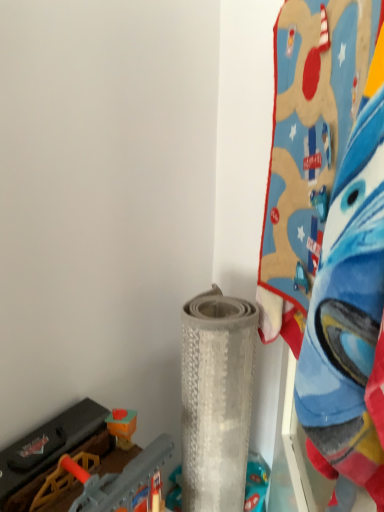
Question: Is the position of gray textured mat at center, the second toy viewed from the left, more distant than that of blue plush blanket at upper right, the 3th toy positioned from the left?

Choices:
 (A) no
 (B) yes

Answer: (B)

Question: Is gray textured mat at center, the second toy viewed from the left, positioned with its back to blue plush blanket at upper right, the 3th toy positioned from the left?

Choices:
 (A) yes
 (B) no

Answer: (B)

Question: Is gray textured mat at center, acting as the second toy starting from the right, positioned in front of blue plush blanket at upper right, the 3th toy positioned from the left?

Choices:
 (A) no
 (B) yes

Answer: (A)

Question: Is gray textured mat at center, acting as the second toy starting from the right, positioned far away from blue plush blanket at upper right, the 3th toy positioned from the left?

Choices:
 (A) no
 (B) yes

Answer: (A)

Question: From the image's perspective, is gray textured mat at center, the second toy viewed from the left, below blue plush blanket at upper right, the 3th toy positioned from the left?

Choices:
 (A) no
 (B) yes

Answer: (B)

Question: Considering the positions of blue plush blanket at upper right, the 3th toy positioned from the left, and gray textured mat at center, acting as the second toy starting from the right, in the image, is blue plush blanket at upper right, the 3th toy positioned from the left, taller or shorter than gray textured mat at center, acting as the second toy starting from the right,?

Choices:
 (A) short
 (B) tall

Answer: (A)

Question: In terms of size, does blue plush blanket at upper right, the 3th toy positioned from the left, appear bigger or smaller than gray textured mat at center, acting as the second toy starting from the right?

Choices:
 (A) big
 (B) small

Answer: (A)

Question: Is blue plush blanket at upper right, the 3th toy positioned from the left, spatially inside gray textured mat at center, the second toy viewed from the left, or outside of it?

Choices:
 (A) inside
 (B) outside

Answer: (B)

Question: Is blue plush blanket at upper right, the 3th toy positioned from the left, wider or thinner than gray textured mat at center, acting as the second toy starting from the right?

Choices:
 (A) wide
 (B) thin

Answer: (B)

Question: Considering the positions of plastic toy train at lower left, positioned as the third toy in right-to-left order, and blue plush blanket at upper right, which is the 1th toy from right to left, in the image, is plastic toy train at lower left, positioned as the third toy in right-to-left order, wider or thinner than blue plush blanket at upper right, which is the 1th toy from right to left,?

Choices:
 (A) thin
 (B) wide

Answer: (B)

Question: From a real-world perspective, is plastic toy train at lower left, placed as the first toy when sorted from left to right, above or below blue plush blanket at upper right, the 3th toy positioned from the left?

Choices:
 (A) above
 (B) below

Answer: (B)

Question: From the image's perspective, is plastic toy train at lower left, placed as the first toy when sorted from left to right, positioned above or below blue plush blanket at upper right, which is the 1th toy from right to left?

Choices:
 (A) above
 (B) below

Answer: (B)

Question: Is point pyautogui.click(x=1, y=460) positioned closer to the camera than point pyautogui.click(x=309, y=246)?

Choices:
 (A) farther
 (B) closer

Answer: (A)

Question: Does point (190, 331) appear closer or farther from the camera than point (289, 214)?

Choices:
 (A) farther
 (B) closer

Answer: (A)

Question: Considering their positions, is gray textured mat at center, the second toy viewed from the left, located in front of or behind blue plush blanket at upper right, the 3th toy positioned from the left?

Choices:
 (A) behind
 (B) front

Answer: (A)